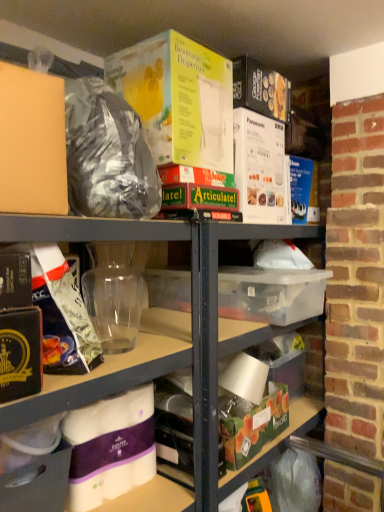
Question: Is transparent plastic jar at center, which is the second yoghurt from bottom to top, situated inside purple paper towel at lower left, positioned as the 1th yoghurt in bottom-to-top order, or outside?

Choices:
 (A) inside
 (B) outside

Answer: (B)

Question: Visually, is transparent plastic jar at center, which is the second yoghurt from bottom to top, positioned to the left or to the right of purple paper towel at lower left, positioned as the 1th yoghurt in bottom-to-top order?

Choices:
 (A) right
 (B) left

Answer: (A)

Question: Which object is positioned farthest from the transparent plastic jar at center, positioned as the second yoghurt in top-to-bottom order?

Choices:
 (A) white cardboard box at lower left, which ranks as the 1th storage box in bottom-to-top order
 (B) transparent plastic storage box at center, acting as the second storage box starting from the right
 (C) green matte storage box at lower center, positioned as the second storage box in top-to-bottom order
 (D) purple paper towel at lower left, which ranks as the 3th yoghurt in top-to-bottom order
 (E) shiny metallic bag at upper left

Answer: (C)

Question: Considering the real-world distances, which object is farthest from the transparent plastic storage box at center, acting as the second storage box starting from the right?

Choices:
 (A) shiny metallic bag at upper left
 (B) transparent plastic jar at center, which is the second yoghurt from bottom to top
 (C) yellow cardboard beverage dispenser at upper center, marked as the third yoghurt in a bottom-to-top arrangement
 (D) white cardboard box at lower left, which is counted as the third storage box, starting from the right
 (E) purple paper towel at lower left, which ranks as the 3th yoghurt in top-to-bottom order

Answer: (D)